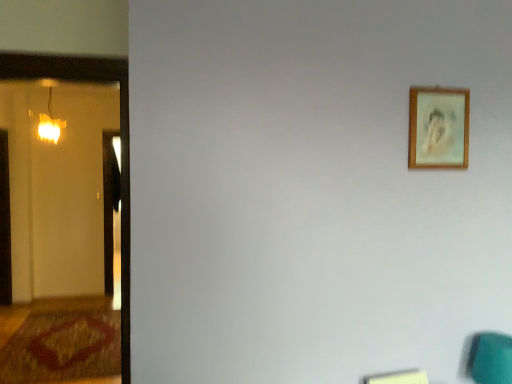
This screenshot has width=512, height=384. What do you see at coordinates (490, 358) in the screenshot?
I see `teal fabric swivel chair at lower right` at bounding box center [490, 358].

Where is `wooden picture frame at upper right`? The width and height of the screenshot is (512, 384). wooden picture frame at upper right is located at coordinates (438, 127).

In the scene shown: Looking at their sizes, would you say matte glass lamp at left is wider or thinner than brown textured rug at lower left?

Clearly, matte glass lamp at left has less width compared to brown textured rug at lower left.

Considering the relative sizes of matte glass lamp at left and brown textured rug at lower left in the image provided, is matte glass lamp at left taller than brown textured rug at lower left?

Yes, matte glass lamp at left is taller than brown textured rug at lower left.

Is point (49, 100) farther from camera compared to point (6, 366)?

Yes.

Is teal fabric swivel chair at lower right far away from brown textured rug at lower left?

teal fabric swivel chair at lower right is far away from brown textured rug at lower left.

Based on the photo, between teal fabric swivel chair at lower right and brown textured rug at lower left, which one has larger width?

Wider between the two is brown textured rug at lower left.

What's the angular difference between teal fabric swivel chair at lower right and brown textured rug at lower left's facing directions?

The facing directions of teal fabric swivel chair at lower right and brown textured rug at lower left are 1.85 degrees apart.

How distant is brown textured rug at lower left from matte glass lamp at left?

The distance of brown textured rug at lower left from matte glass lamp at left is 1.90 meters.

From their relative heights in the image, would you say brown textured rug at lower left is taller or shorter than matte glass lamp at left?

In the image, brown textured rug at lower left appears to be shorter than matte glass lamp at left.

Is brown textured rug at lower left far away from matte glass lamp at left?

Yes.

Does brown textured rug at lower left contain matte glass lamp at left?

Definitely not — matte glass lamp at left is not inside brown textured rug at lower left.

Does point (438, 122) come behind point (497, 370)?

Yes, point (438, 122) is behind point (497, 370).

Is wooden picture frame at upper right turned away from teal fabric swivel chair at lower right?

No.

Which object is thinner, wooden picture frame at upper right or teal fabric swivel chair at lower right?

Thinner between the two is wooden picture frame at upper right.

Does wooden picture frame at upper right appear on the left side of teal fabric swivel chair at lower right?

Yes.

How many degrees apart are the facing directions of wooden picture frame at upper right and brown textured rug at lower left?

0.384 degrees separate the facing orientations of wooden picture frame at upper right and brown textured rug at lower left.

Is wooden picture frame at upper right wider than brown textured rug at lower left?

No.

Is brown textured rug at lower left at the back of wooden picture frame at upper right?

wooden picture frame at upper right is not turned away from brown textured rug at lower left.

Considering the positions of objects wooden picture frame at upper right and brown textured rug at lower left in the image provided, who is in front, wooden picture frame at upper right or brown textured rug at lower left?

wooden picture frame at upper right.

Is brown textured rug at lower left bigger than wooden picture frame at upper right?

Correct, brown textured rug at lower left is larger in size than wooden picture frame at upper right.

Does brown textured rug at lower left come in front of wooden picture frame at upper right?

No, it is not.

Does point (118, 311) lie behind point (426, 165)?

Yes, it is.

Which of these two, teal fabric swivel chair at lower right or matte glass lamp at left, is thinner?

Thinner between the two is teal fabric swivel chair at lower right.

Are teal fabric swivel chair at lower right and matte glass lamp at left far apart?

Yes, teal fabric swivel chair at lower right and matte glass lamp at left are located far from each other.

Is teal fabric swivel chair at lower right shorter than matte glass lamp at left?

Yes, teal fabric swivel chair at lower right is shorter than matte glass lamp at left.

From a real-world perspective, is teal fabric swivel chair at lower right on top of matte glass lamp at left?

Incorrect, from a real-world perspective, teal fabric swivel chair at lower right is lower than matte glass lamp at left.

Find the location of a particular element. The width and height of the screenshot is (512, 384). doormat below the matte glass lamp at left (from the image's perspective) is located at coordinates (63, 348).

This screenshot has width=512, height=384. Find the location of `swivel chair above the brown textured rug at lower left (from the image's perspective)`. swivel chair above the brown textured rug at lower left (from the image's perspective) is located at coordinates (490, 358).

Based on their spatial positions, is brown textured rug at lower left or matte glass lamp at left closer to teal fabric swivel chair at lower right?

Based on the image, brown textured rug at lower left appears to be nearer to teal fabric swivel chair at lower right.

When comparing their distances from wooden picture frame at upper right, does matte glass lamp at left or brown textured rug at lower left seem further?

Among the two, brown textured rug at lower left is located further to wooden picture frame at upper right.

When comparing their distances from brown textured rug at lower left, does matte glass lamp at left or wooden picture frame at upper right seem further?

wooden picture frame at upper right.

Considering their positions, is teal fabric swivel chair at lower right positioned further to brown textured rug at lower left than matte glass lamp at left?

teal fabric swivel chair at lower right lies further to brown textured rug at lower left than the other object.

From the picture: From the image, which object appears to be nearer to wooden picture frame at upper right, matte glass lamp at left or teal fabric swivel chair at lower right?

teal fabric swivel chair at lower right is closer to wooden picture frame at upper right.

Looking at the image, which one is located further to matte glass lamp at left, brown textured rug at lower left or wooden picture frame at upper right?

wooden picture frame at upper right is positioned further to the anchor matte glass lamp at left.

From the image, which object appears to be nearer to matte glass lamp at left, teal fabric swivel chair at lower right or brown textured rug at lower left?

Based on the image, brown textured rug at lower left appears to be nearer to matte glass lamp at left.

From the image, which object appears to be farther from wooden picture frame at upper right, brown textured rug at lower left or matte glass lamp at left?

brown textured rug at lower left is further to wooden picture frame at upper right.

Where is `picture frame between brown textured rug at lower left and teal fabric swivel chair at lower right`? picture frame between brown textured rug at lower left and teal fabric swivel chair at lower right is located at coordinates [x=438, y=127].

The width and height of the screenshot is (512, 384). Find the location of `picture frame situated between matte glass lamp at left and teal fabric swivel chair at lower right from left to right`. picture frame situated between matte glass lamp at left and teal fabric swivel chair at lower right from left to right is located at coordinates (438, 127).

The width and height of the screenshot is (512, 384). In order to click on lamp between brown textured rug at lower left and teal fabric swivel chair at lower right in the horizontal direction in this screenshot , I will do `click(50, 124)`.

Locate an element on the screen. lamp located between brown textured rug at lower left and wooden picture frame at upper right in the left-right direction is located at coordinates [x=50, y=124].